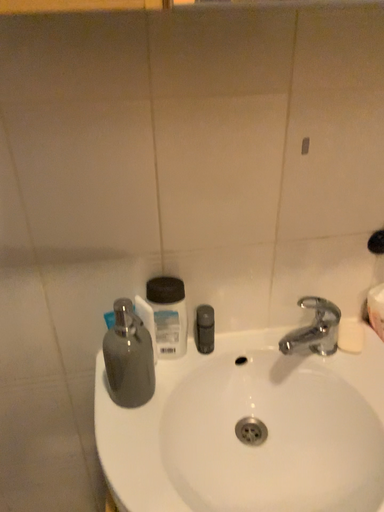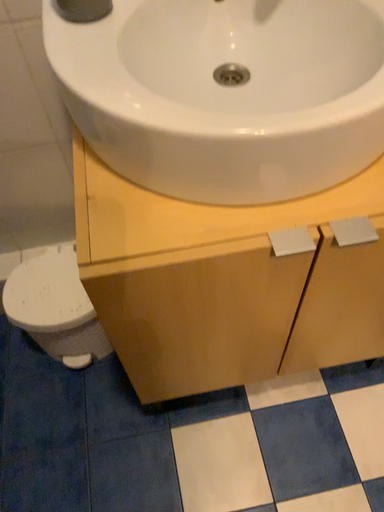
Question: How did the camera likely rotate when shooting the video?

Choices:
 (A) rotated upward
 (B) rotated downward

Answer: (B)